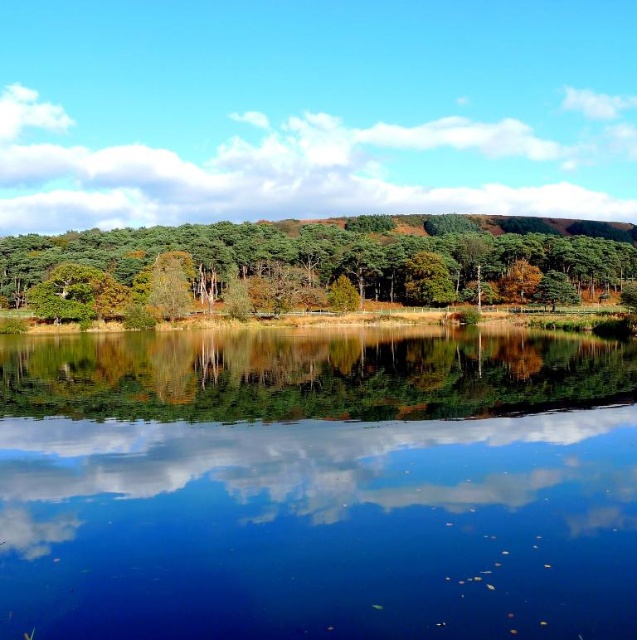
Question: Considering the real-world distances, which object is closest to the green matte tree at center?

Choices:
 (A) transparent glass water at center
 (B) white fluffy cloud at upper center

Answer: (A)

Question: Can you confirm if transparent glass water at center is smaller than white fluffy cloud at upper center?

Choices:
 (A) no
 (B) yes

Answer: (B)

Question: Which object is positioned closest to the green matte tree at center?

Choices:
 (A) white fluffy cloud at upper center
 (B) transparent glass water at center

Answer: (B)

Question: Can you confirm if white fluffy cloud at upper center is thinner than green matte tree at center?

Choices:
 (A) no
 (B) yes

Answer: (A)

Question: Can you confirm if transparent glass water at center is wider than white fluffy cloud at upper center?

Choices:
 (A) yes
 (B) no

Answer: (B)

Question: Which object is the farthest from the green matte tree at center?

Choices:
 (A) white fluffy cloud at upper center
 (B) transparent glass water at center

Answer: (A)